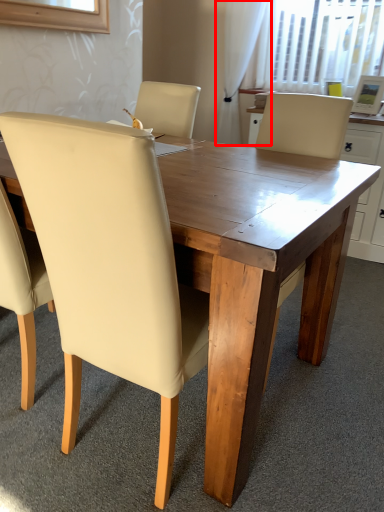
Question: From the image's perspective, what is the correct spatial relationship of curtain (annotated by the red box) in relation to chair?

Choices:
 (A) below
 (B) above

Answer: (B)